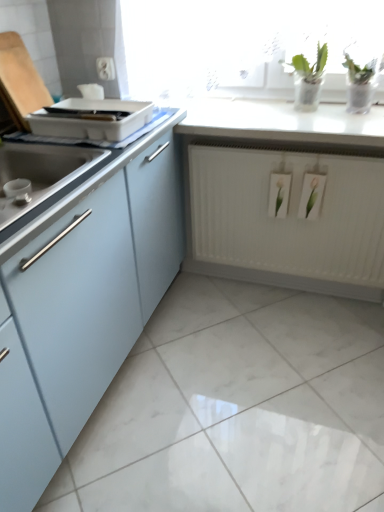
Locate an element on the screen. This screenshot has width=384, height=512. free space above white matte radiator at center (from a real-world perspective) is located at coordinates (291, 145).